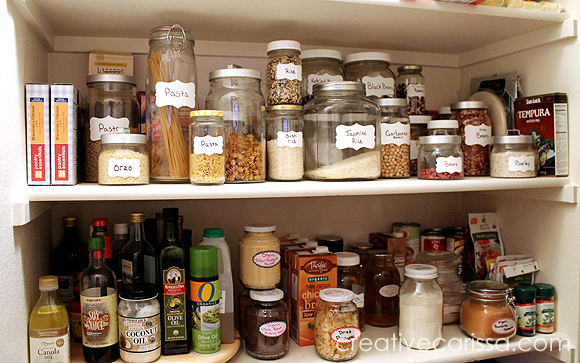
Where is `bottles`? bottles is located at coordinates (100, 306), (105, 240), (116, 238), (137, 243), (177, 276), (48, 326), (224, 301), (188, 235), (151, 264).